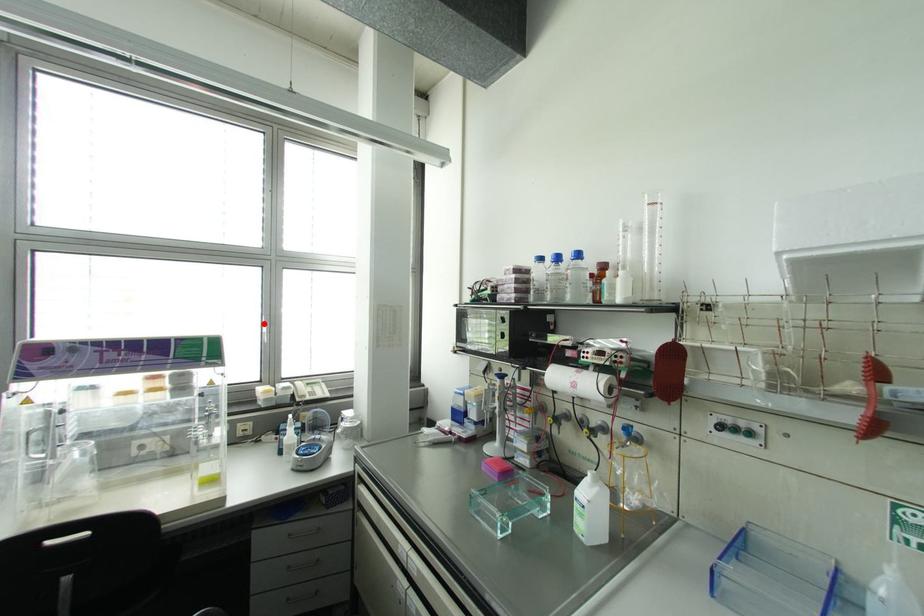
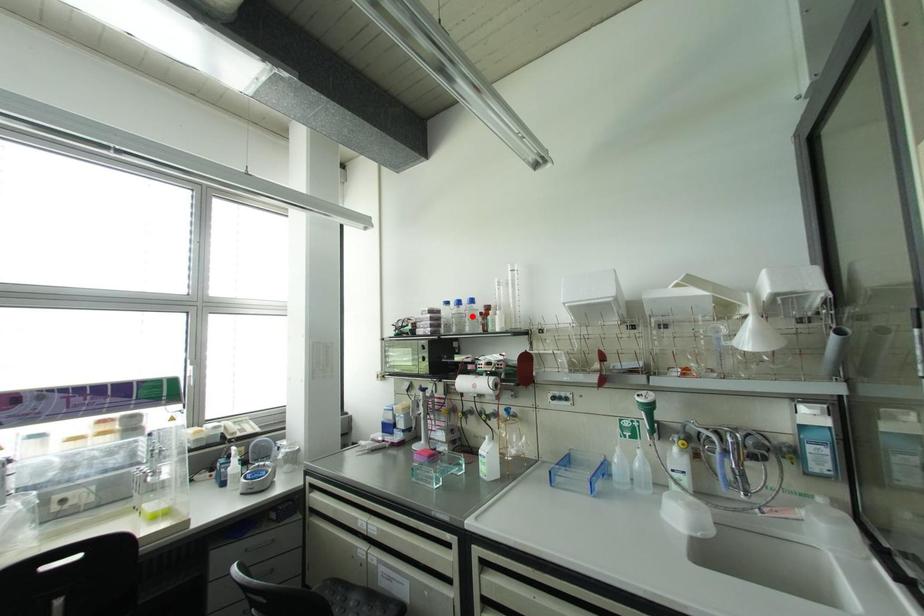
I am providing you with two images of the same scene from different viewpoints. A red point is marked on the first image and another point is marked on the second image. Does the point marked in image1 correspond to the same location as the one in image2?

No